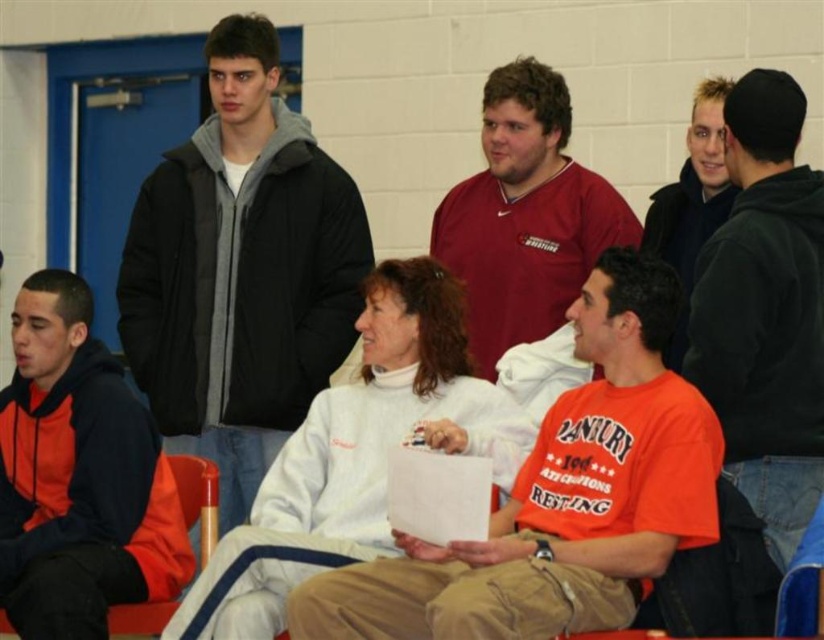
Question: Which point is farther to the camera?

Choices:
 (A) (261, 272)
 (B) (550, 88)

Answer: (A)

Question: Does orange cotton t-shirt at center have a lesser width compared to blonde hair man at upper right?

Choices:
 (A) no
 (B) yes

Answer: (A)

Question: Which object is the closest to the white fleece jacket at center?

Choices:
 (A) matte red shirt at center
 (B) blonde hair man at upper right
 (C) orange cotton t-shirt at center

Answer: (C)

Question: Can you confirm if black hoodie at upper right is positioned to the right of matte red shirt at center?

Choices:
 (A) yes
 (B) no

Answer: (A)

Question: Which point is closer to the camera taking this photo?

Choices:
 (A) (176, 205)
 (B) (747, 381)

Answer: (B)

Question: Considering the relative positions of orange cotton t-shirt at center and white fleece jacket at center in the image provided, where is orange cotton t-shirt at center located with respect to white fleece jacket at center?

Choices:
 (A) left
 (B) right

Answer: (B)